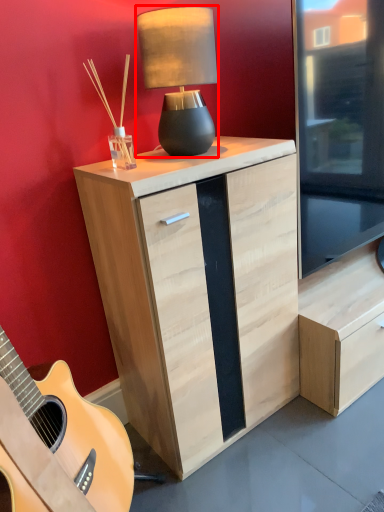
Question: Considering the relative positions of lamp (annotated by the red box) and chest of drawers in the image provided, where is lamp (annotated by the red box) located with respect to the staircase?

Choices:
 (A) right
 (B) left

Answer: (B)